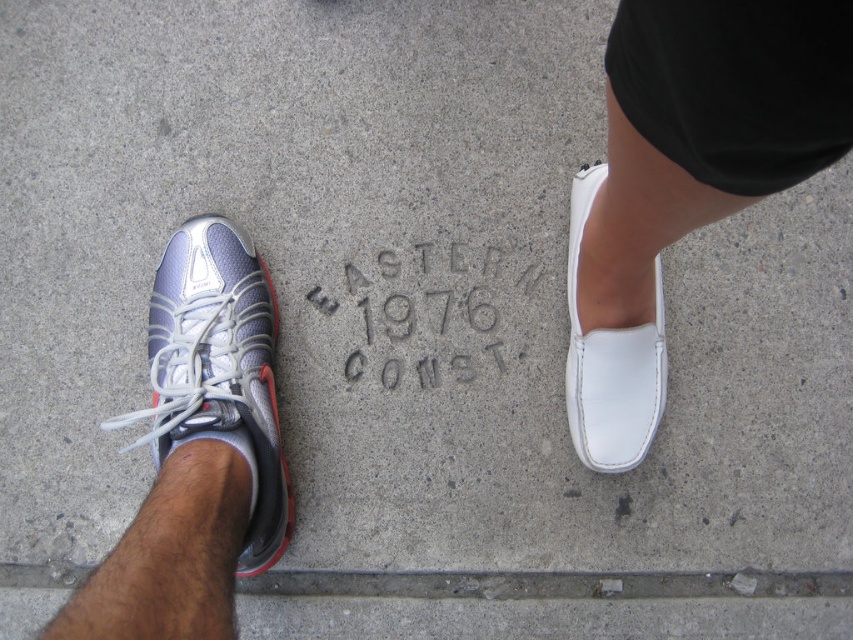
Question: Considering the relative positions of silver mesh sneaker at left and gray concrete engraving at center in the image provided, where is silver mesh sneaker at left located with respect to gray concrete engraving at center?

Choices:
 (A) below
 (B) above

Answer: (A)

Question: Is white leather shoe at right bigger than silver mesh sneaker at left?

Choices:
 (A) no
 (B) yes

Answer: (B)

Question: Which point is closer to the camera taking this photo?

Choices:
 (A) (375, 340)
 (B) (598, 412)
 (C) (640, 376)

Answer: (C)

Question: Which object appears closest to the camera in this image?

Choices:
 (A) silver mesh sneaker at left
 (B) white leather loafer at right
 (C) gray concrete engraving at center

Answer: (A)

Question: Which of the following is the farthest from the observer?

Choices:
 (A) gray concrete engraving at center
 (B) white leather loafer at right
 (C) silver mesh sneaker at left

Answer: (A)

Question: Observing the image, what is the correct spatial positioning of silver mesh sneaker at left in reference to gray concrete engraving at center?

Choices:
 (A) right
 (B) left

Answer: (B)